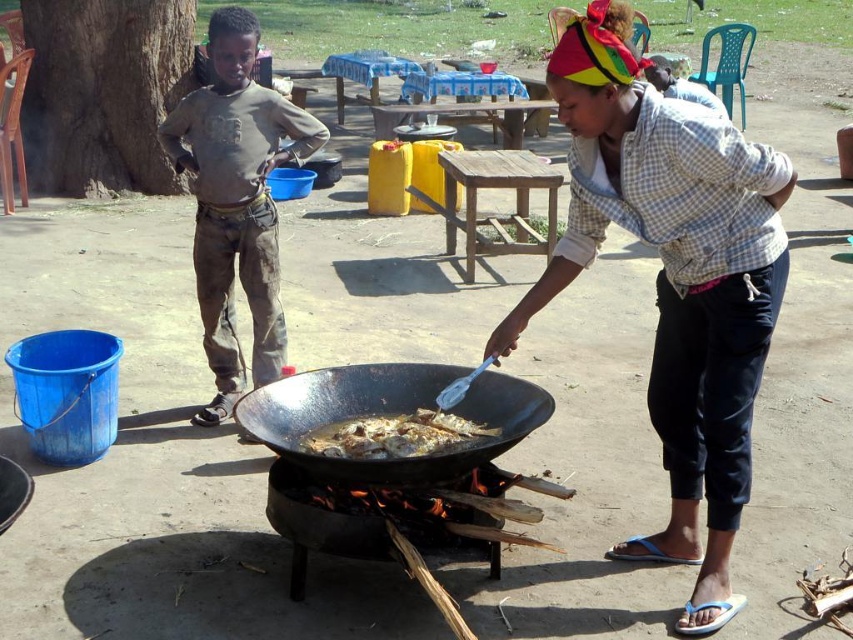
Question: Which point is farther from the camera taking this photo?

Choices:
 (A) (200, 275)
 (B) (322, 400)
 (C) (415, 433)

Answer: (A)

Question: Based on their relative distances, which object is nearer to the brown cotton pants at left?

Choices:
 (A) black matte wok at center
 (B) golden brown crispy fish at center

Answer: (A)

Question: Does brown cotton pants at left appear over black matte wok at center?

Choices:
 (A) no
 (B) yes

Answer: (B)

Question: Does brown cotton pants at left have a smaller size compared to black matte wok at center?

Choices:
 (A) no
 (B) yes

Answer: (A)

Question: Which point is closer to the camera?

Choices:
 (A) golden brown crispy fish at center
 (B) brown cotton pants at left

Answer: (A)

Question: Is black matte wok at center wider than golden brown crispy fish at center?

Choices:
 (A) no
 (B) yes

Answer: (B)